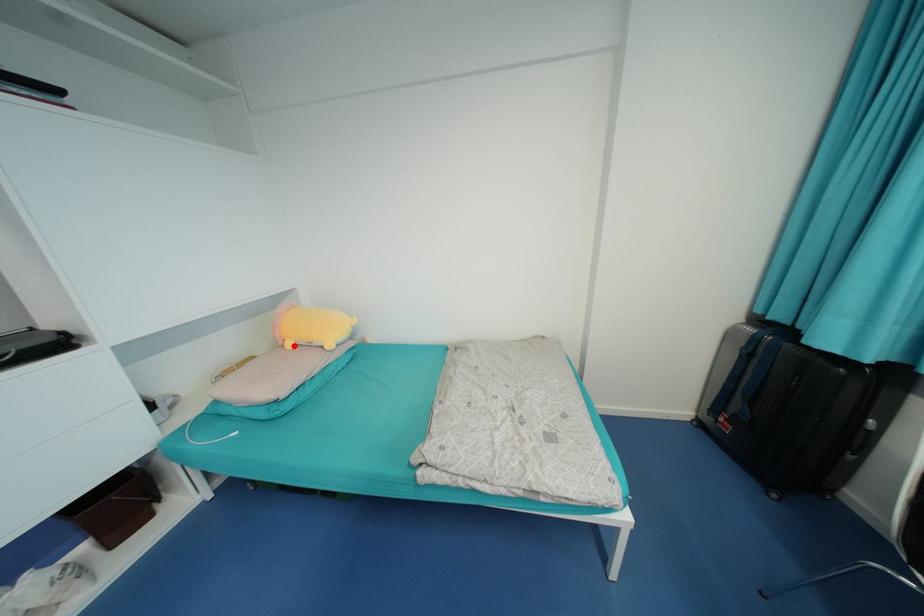
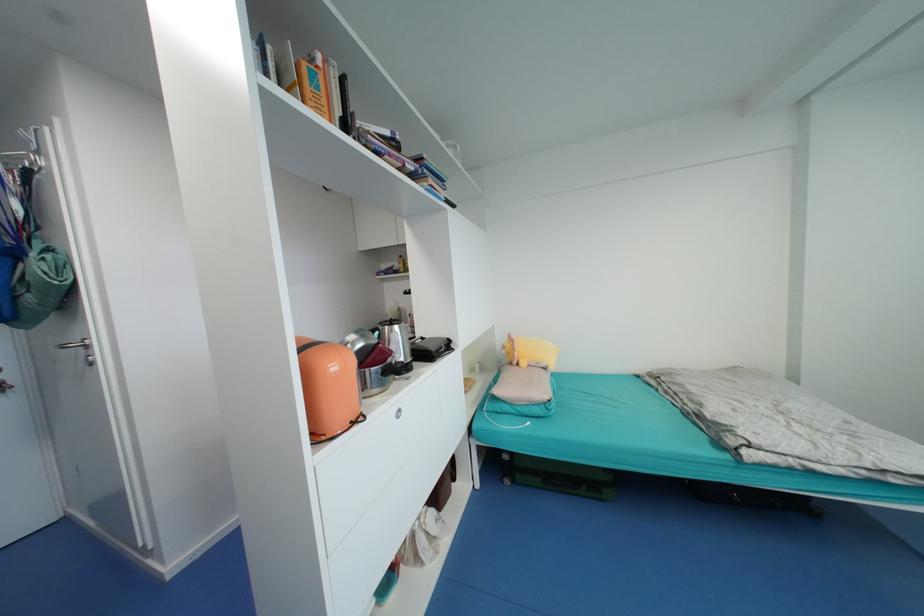
Question: I am providing you with two images of the same scene from different viewpoints. Given a red point in image1, look at the same physical point in image2. Is it:

Choices:
 (A) Closer to the viewpoint
 (B) Farther from the viewpoint

Answer: (B)